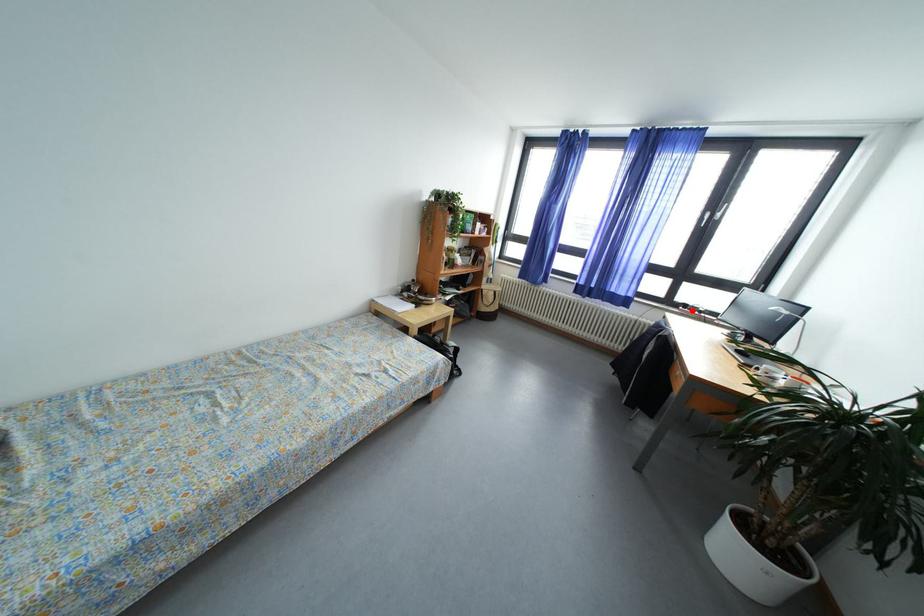
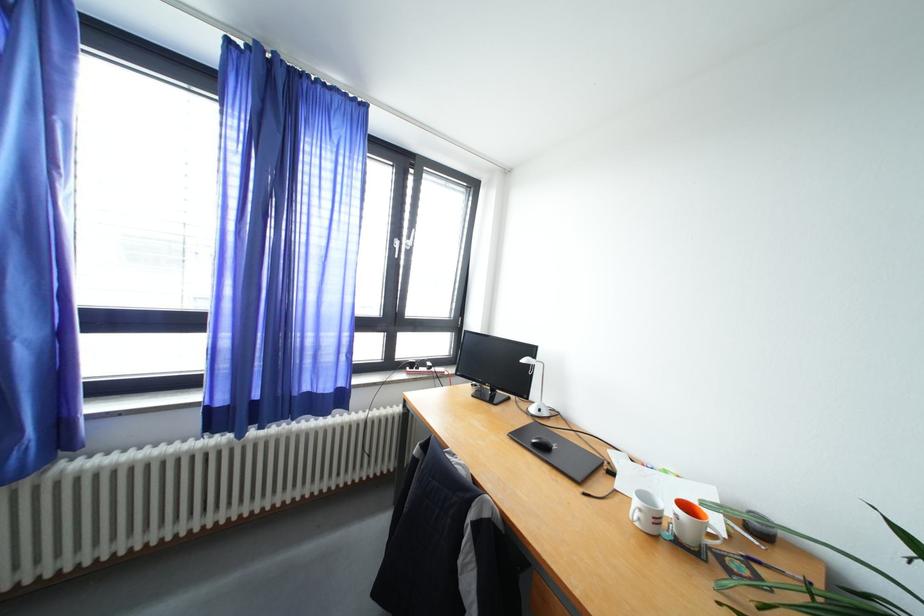
Question: I am providing you with two images of the same scene from different viewpoints. Image1 has a red point marked. In image2, the corresponding 3D location appears at what relative position? Reply with the corresponding letter.

Choices:
 (A) Closer
 (B) Farther

Answer: (B)